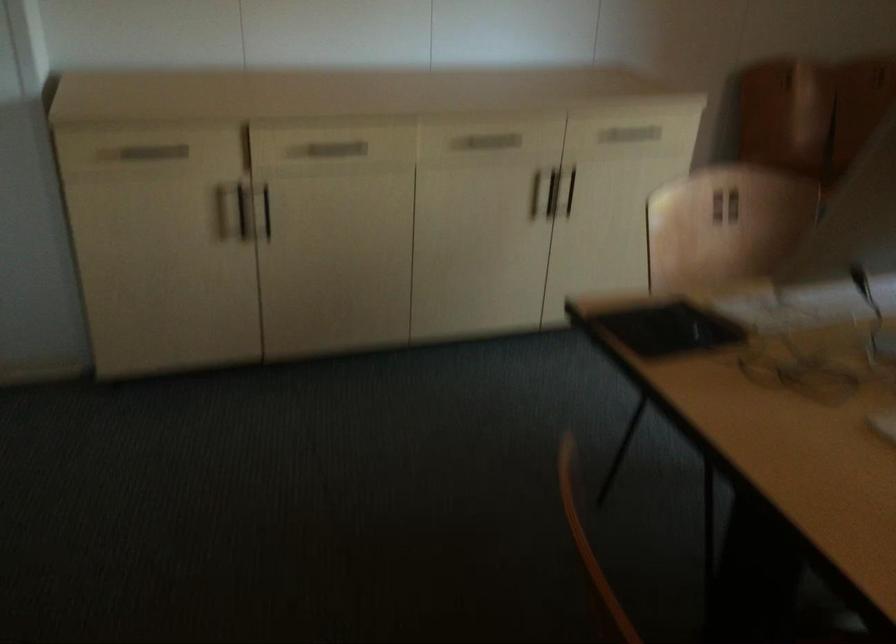
Where is `black tablet`? The height and width of the screenshot is (644, 896). black tablet is located at coordinates (668, 328).